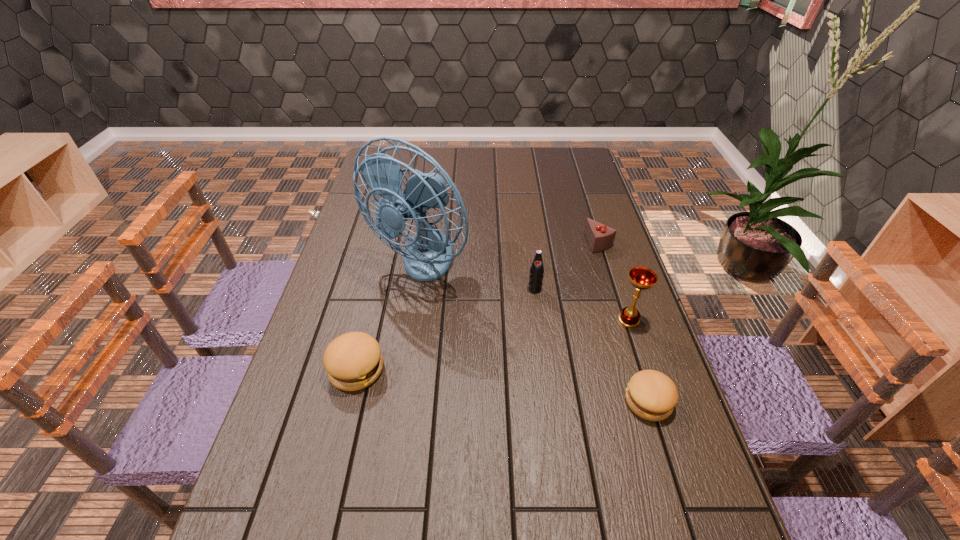
If equal spacing is the goal by inserting an additional hamburger among them, please point out a vacant space for this new hamburger. Please provide its 2D coordinates. Your answer should be formatted as a tuple, i.e. [(x, y)], where the tuple contains the x and y coordinates of a point satisfying the conditions above.

[(498, 385)]